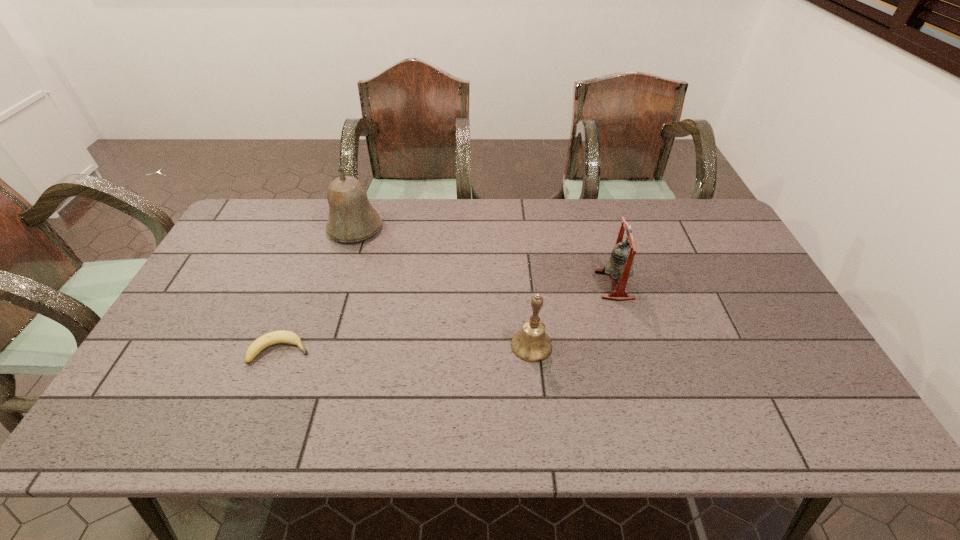
Point out which bell is positioned as the nearest to the farthest object. Please provide its 2D coordinates. Your answer should be formatted as a tuple, i.e. [(x, y)], where the tuple contains the x and y coordinates of a point satisfying the conditions above.

[(531, 344)]

Identify which bell is the second closest to the banana. Please provide its 2D coordinates. Your answer should be formatted as a tuple, i.e. [(x, y)], where the tuple contains the x and y coordinates of a point satisfying the conditions above.

[(531, 344)]

This screenshot has width=960, height=540. Find the location of `free space in the image that satisfies the following two spatial constraints: 1. on the front side of the farthest bell; 2. on the right side of the second nearest bell`. free space in the image that satisfies the following two spatial constraints: 1. on the front side of the farthest bell; 2. on the right side of the second nearest bell is located at coordinates (337, 285).

Find the location of `vacant space that satisfies the following two spatial constraints: 1. on the front side of the second bell from right to left; 2. on the left side of the leftmost bell`. vacant space that satisfies the following two spatial constraints: 1. on the front side of the second bell from right to left; 2. on the left side of the leftmost bell is located at coordinates (318, 345).

Locate an element on the screen. The width and height of the screenshot is (960, 540). free point that satisfies the following two spatial constraints: 1. on the back side of the rightmost object; 2. on the left side of the nearest bell is located at coordinates (525, 285).